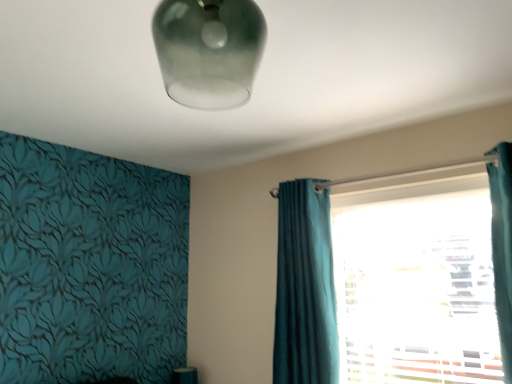
Measure the distance between point (301, 298) and camera.

7.07 feet.

Identify the location of teal velvet curtain at center. Image resolution: width=512 pixels, height=384 pixels. (305, 288).

In order to face frosted glass lampshade at upper center, should I rotate leftwards or rightwards?

To face it directly, rotate left by 8.377 degrees.

Where is `teal fabric curtain at right`? The width and height of the screenshot is (512, 384). teal fabric curtain at right is located at coordinates (385, 251).

Would you say teal fabric curtain at right is part of teal velvet curtain at center's contents?

Definitely not — teal fabric curtain at right is not inside teal velvet curtain at center.

Can you confirm if teal velvet curtain at center is smaller than teal fabric curtain at right?

Yes, teal velvet curtain at center is smaller than teal fabric curtain at right.

From a real-world perspective, relative to teal fabric curtain at right, is teal velvet curtain at center vertically above or below?

In terms of real-world spatial position, teal velvet curtain at center is above teal fabric curtain at right.

Is teal velvet curtain at center thinner than teal fabric curtain at right?

Indeed, teal velvet curtain at center has a lesser width compared to teal fabric curtain at right.

Between frosted glass lampshade at upper center and teal velvet curtain at center, which one has smaller size?

With smaller size is frosted glass lampshade at upper center.

Between frosted glass lampshade at upper center and teal velvet curtain at center, which one is positioned in front?

frosted glass lampshade at upper center is closer to the camera.

Is frosted glass lampshade at upper center looking in the opposite direction of teal velvet curtain at center?

No, frosted glass lampshade at upper center is not facing away from teal velvet curtain at center.

From the image's perspective, would you say teal fabric curtain at right is positioned over teal velvet curtain at center?

Yes, from the image's perspective, teal fabric curtain at right is above teal velvet curtain at center.

Considering the positions of objects teal fabric curtain at right and teal velvet curtain at center in the image provided, who is behind, teal fabric curtain at right or teal velvet curtain at center?

teal velvet curtain at center is further away from the camera.

Does teal fabric curtain at right turn towards teal velvet curtain at center?

Yes, teal fabric curtain at right faces towards teal velvet curtain at center.

Is teal fabric curtain at right not near frosted glass lampshade at upper center?

Indeed, teal fabric curtain at right is not near frosted glass lampshade at upper center.

From the image's perspective, is teal fabric curtain at right over frosted glass lampshade at upper center?

No, from the image's perspective, teal fabric curtain at right is not on top of frosted glass lampshade at upper center.

Which is nearer, (311, 378) or (252, 57)?

The point (252, 57) is in front.

Is teal fabric curtain at right shorter than frosted glass lampshade at upper center?

No, teal fabric curtain at right is not shorter than frosted glass lampshade at upper center.

Could you tell me if teal velvet curtain at center is turned towards frosted glass lampshade at upper center?

No, teal velvet curtain at center is not turned towards frosted glass lampshade at upper center.

Is frosted glass lampshade at upper center inside teal velvet curtain at center?

No, frosted glass lampshade at upper center is located outside of teal velvet curtain at center.

Considering the sizes of objects teal velvet curtain at center and frosted glass lampshade at upper center in the image provided, who is thinner, teal velvet curtain at center or frosted glass lampshade at upper center?

Thinner between the two is teal velvet curtain at center.

From the image's perspective, which is below, teal velvet curtain at center or frosted glass lampshade at upper center?

teal velvet curtain at center, from the image's perspective.

Do you think frosted glass lampshade at upper center is within teal fabric curtain at right, or outside of it?

frosted glass lampshade at upper center lies outside teal fabric curtain at right.

Is point (222, 97) positioned behind point (309, 280)?

No, (222, 97) is closer to viewer.

Find the location of a particular element. lamp located on the left of teal fabric curtain at right is located at coordinates (209, 50).

How many degrees apart are the facing directions of frosted glass lampshade at upper center and teal fabric curtain at right?

The facing directions of frosted glass lampshade at upper center and teal fabric curtain at right are 1.4 degrees apart.

You are a GUI agent. You are given a task and a screenshot of the screen. Output one action in this format:
    pyautogui.click(x=<x>, y=<y>)
    Task: Click on the window directly beneath the teal velvet curtain at center (from a real-world perspective)
    
    Given the screenshot: What is the action you would take?
    pyautogui.click(x=385, y=251)

In order to click on lamp located in front of the teal velvet curtain at center in this screenshot , I will do tap(209, 50).

Based on their spatial positions, is frosted glass lampshade at upper center or teal velvet curtain at center closer to teal fabric curtain at right?

Among the two, teal velvet curtain at center is located nearer to teal fabric curtain at right.

From the picture: When comparing their distances from teal fabric curtain at right, does teal velvet curtain at center or frosted glass lampshade at upper center seem closer?

teal velvet curtain at center is closer to teal fabric curtain at right.

Based on their spatial positions, is frosted glass lampshade at upper center or teal fabric curtain at right closer to teal velvet curtain at center?

teal fabric curtain at right is closer to teal velvet curtain at center.

Estimate the real-world distances between objects in this image. Which object is closer to teal velvet curtain at center, teal fabric curtain at right or frosted glass lampshade at upper center?

teal fabric curtain at right is positioned closer to the anchor teal velvet curtain at center.

Looking at the image, which one is located further to frosted glass lampshade at upper center, teal fabric curtain at right or teal velvet curtain at center?

teal fabric curtain at right.

Based on their spatial positions, is teal velvet curtain at center or teal fabric curtain at right closer to frosted glass lampshade at upper center?

teal velvet curtain at center.

I want to click on window between frosted glass lampshade at upper center and teal velvet curtain at center from front to back, so click(x=385, y=251).